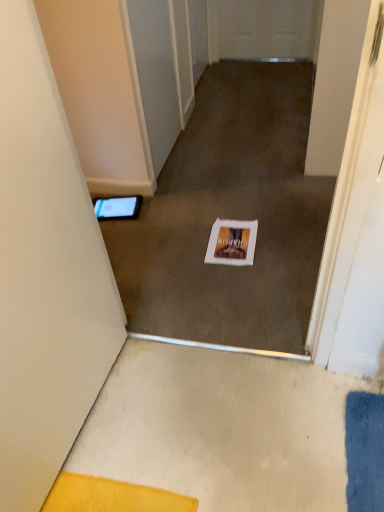
Identify the location of free space underneath black glossy tablet at left (from a real-world perspective). (113, 213).